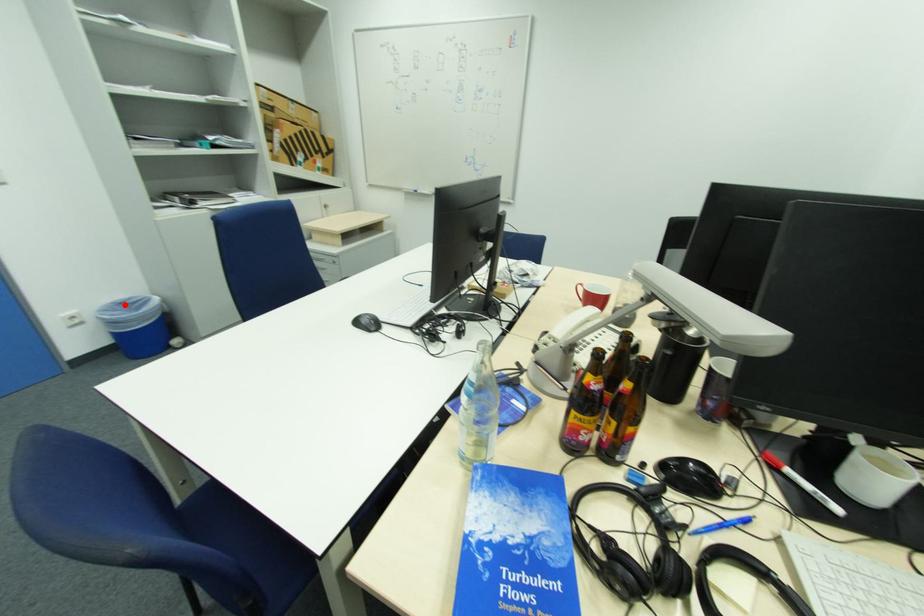
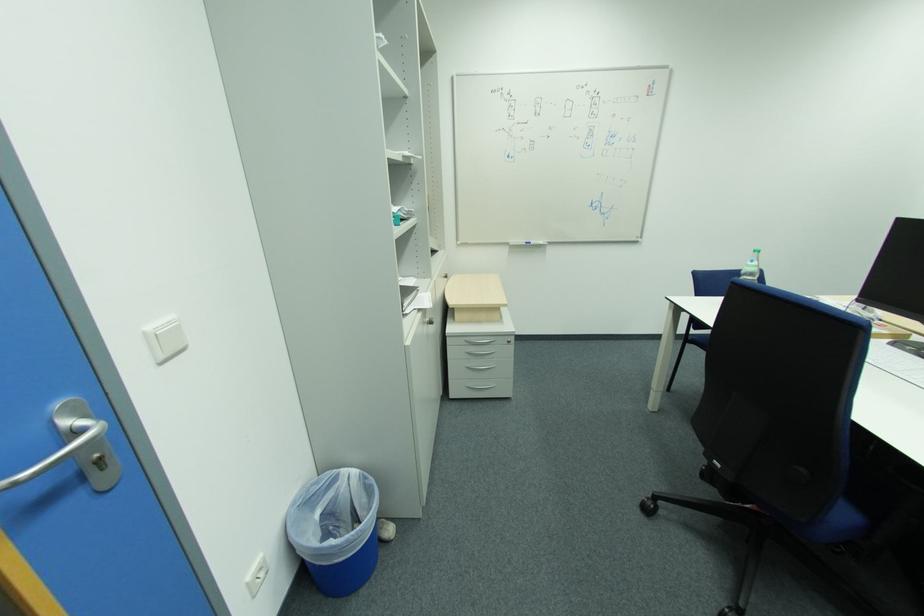
Question: A red point is marked in image1. In image2, is the corresponding 3D point closer to the camera or farther? Reply with the corresponding letter.

Choices:
 (A) The corresponding 3D point is closer.
 (B) The corresponding 3D point is farther.

Answer: (B)